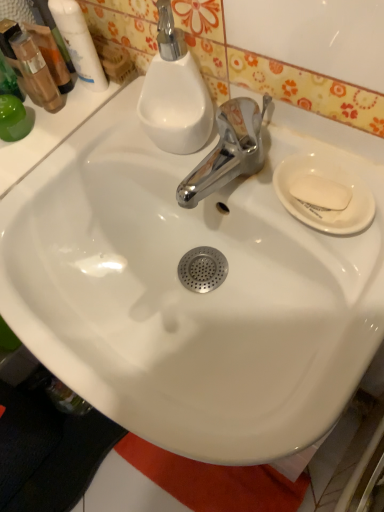
The width and height of the screenshot is (384, 512). I want to click on vacant area that is in front of translucent plastic mouthwash at upper left, which is the second mouthwash in right-to-left order, so pyautogui.click(x=76, y=153).